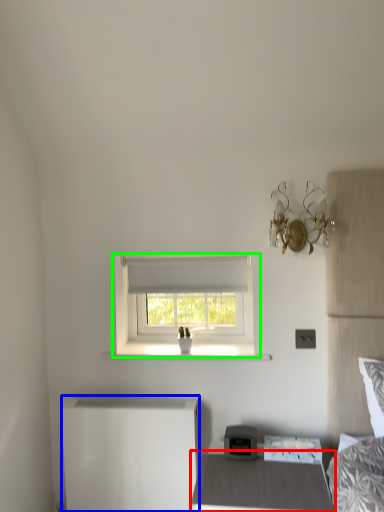
Question: Which object is the closest to the nightstand (highlighted by a red box)? Choose among these: changing table (highlighted by a blue box) or window (highlighted by a green box).

Choices:
 (A) changing table
 (B) window

Answer: (A)